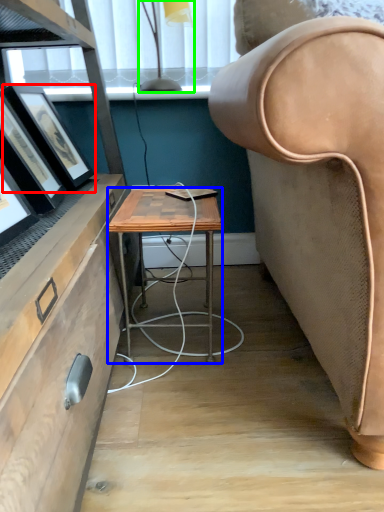
Question: Based on their relative distances, which object is nearer to picture frame (highlighted by a red box)? Choose from desk (highlighted by a blue box) and lamp (highlighted by a green box).

Choices:
 (A) desk
 (B) lamp

Answer: (A)